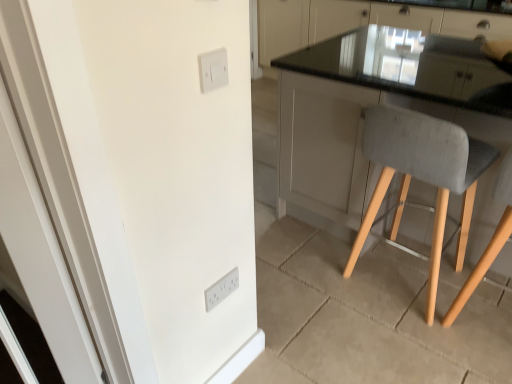
Question: From a real-world perspective, is gray fabric chair at right positioned above or below white glossy door at left?

Choices:
 (A) below
 (B) above

Answer: (A)

Question: Based on their positions, is gray fabric chair at right located to the left or right of white glossy door at left?

Choices:
 (A) right
 (B) left

Answer: (A)

Question: Based on their relative distances, which object is farther from the black glass countertop at upper right?

Choices:
 (A) white plastic light switch at upper center, the 1th light switch in the top-to-bottom sequence
 (B) white glossy door at left
 (C) white plastic light switch at lower center, acting as the first light switch starting from the back
 (D) gray fabric chair at right

Answer: (B)

Question: Considering the real-world distances, which object is farthest from the black glass countertop at upper right?

Choices:
 (A) white glossy door at left
 (B) white plastic light switch at lower center, the second light switch from the front
 (C) gray fabric chair at right
 (D) white plastic light switch at upper center, the 2th light switch in the bottom-to-top sequence

Answer: (A)